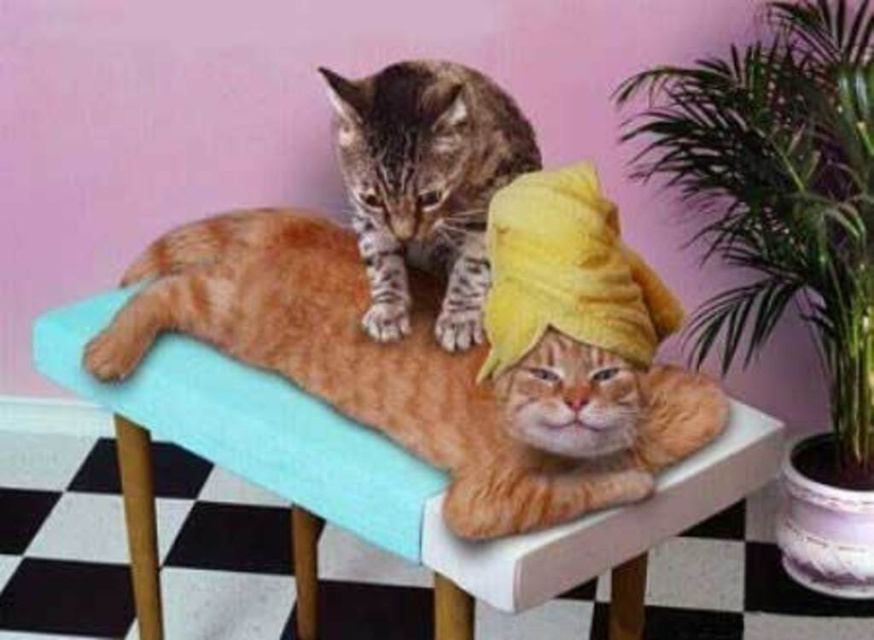
You are a photographer setting up a shoot in this scene. You need to place a small tripod between the teal fabric chair at center and the tabby fur cat at upper center. Considering their sizes, will the tripod fit comfortably between them?

The teal fabric chair at center is bigger than the tabby fur cat at upper center, so there should be enough space for the tripod between them.

You are a photographer trying to capture a photo of both the green leafy plant at right and the tabby fur cat at upper center. However, you notice that one of them is closer to you than the other. Which object is closer to your camera position?

The green leafy plant at right is closer to the camera than the tabby fur cat at upper center because it is further to the viewer.